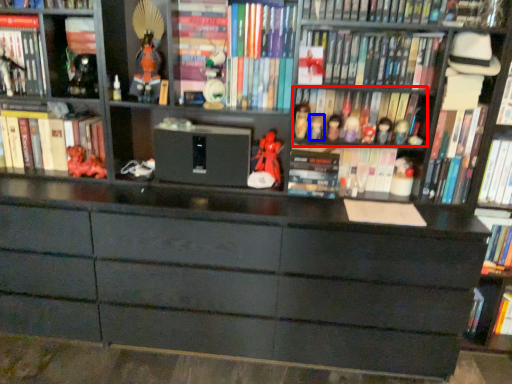
Question: Which object is closer to the camera taking this photo, book (highlighted by a red box) or toy (highlighted by a blue box)?

Choices:
 (A) book
 (B) toy

Answer: (B)